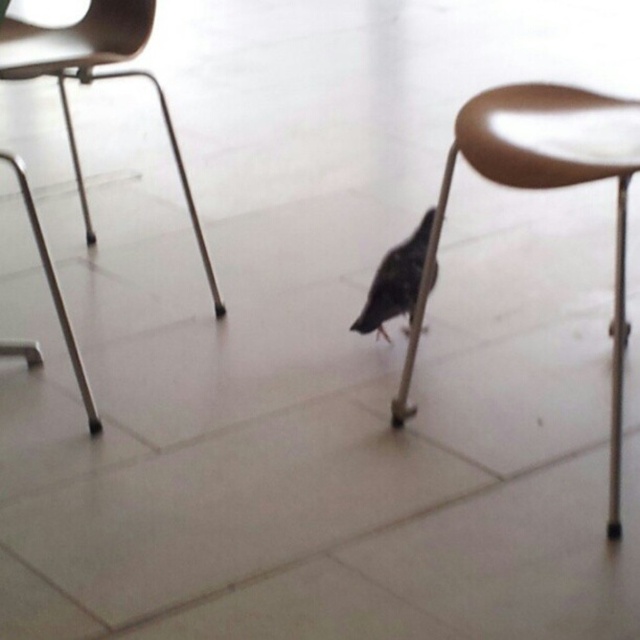
You are holding a camera and want to take a photo of the matte brown stool at center. If you are standing 1.31 meters away from it, will you be able to capture the entire stool in your shot without moving closer?

Yes, since the distance between you and the matte brown stool at center is exactly 1.31 meters, which is the required distance to capture the entire stool in the camera frame without needing to move closer.

You are standing in the room and want to place a small toy between the two points, point (488, 122) and point (408, 289). Which point should you place it closer to so that it appears larger to someone looking from the front?

You should place the toy closer to point (488, 122) because it is closer to the viewer than point (408, 289), making it appear larger when viewed from the front.

Looking at this image, you are a small pet bird that needs to reach the top of the matte brown stool at center to rest. Given your height, can you perch on it considering the dark gray matte bird at center is also present?

The matte brown stool at center is much taller than the dark gray matte bird at center, so if the bird can reach the stool top, it can perch there. However, the presence of the dark gray matte bird at center might affect availability.